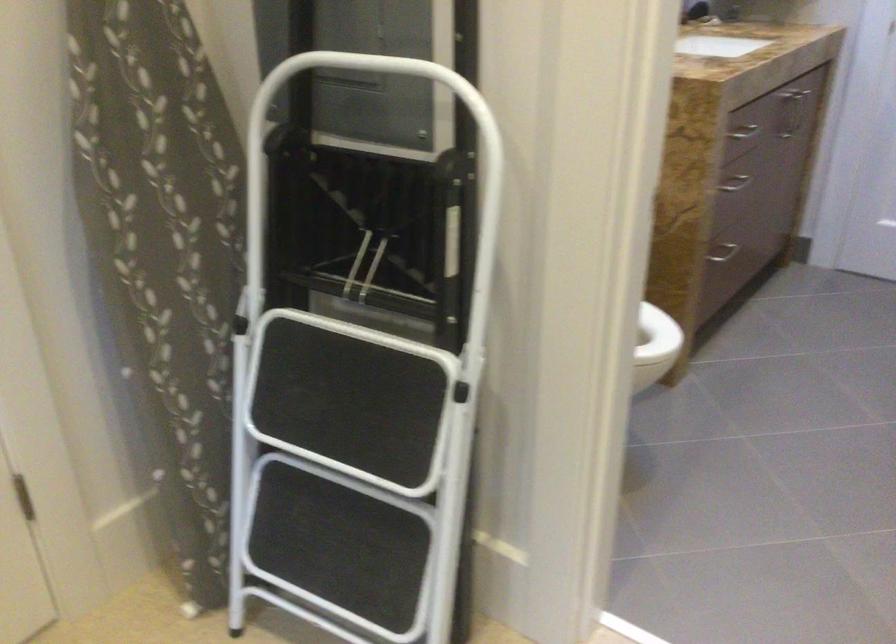
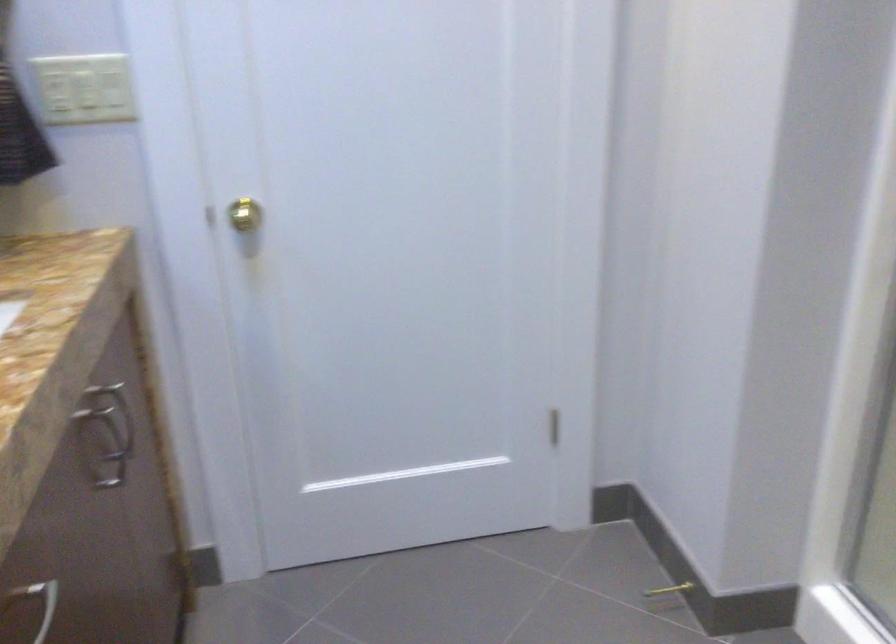
Find the pixel in the second image that matches (787,122) in the first image.

(113, 453)